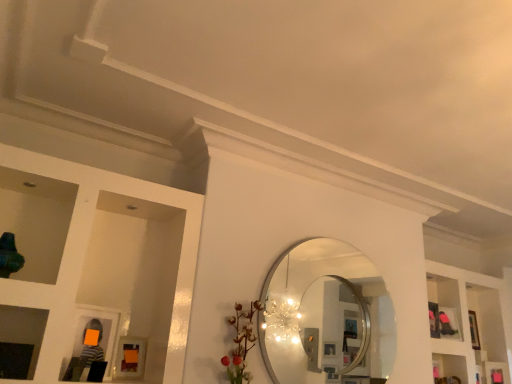
Measure the distance between point (464, 301) and camera.

3.80 meters.

Identify the location of silver metallic mirror at center. (325, 316).

I want to click on shelf behind the matte orange picture frame at lower left, so click(477, 321).

Does white glossy shelves at upper right have a lesser height compared to matte orange picture frame at lower left?

No, white glossy shelves at upper right is not shorter than matte orange picture frame at lower left.

In the scene shown: Considering the relative sizes of white glossy shelves at upper right and matte orange picture frame at lower left in the image provided, is white glossy shelves at upper right smaller than matte orange picture frame at lower left?

No, white glossy shelves at upper right is not smaller than matte orange picture frame at lower left.

Considering the positions of point (498, 292) and point (138, 368), is point (498, 292) closer or farther from the camera than point (138, 368)?

Point (498, 292).

Can you confirm if matte orange picture frame at lower left is shorter than silver metallic mirror at center?

Yes.

From the image's perspective, which is below, matte orange picture frame at lower left or silver metallic mirror at center?

matte orange picture frame at lower left, from the image's perspective.

Where is `mirror behind the matte orange picture frame at lower left`? The height and width of the screenshot is (384, 512). mirror behind the matte orange picture frame at lower left is located at coordinates (325, 316).

How far apart are matte orange picture frame at lower left and silver metallic mirror at center?

3.73 feet.

What's the angular difference between matte orange picture frame at lower left and white glossy shelves at upper right's facing directions?

The angle between the facing direction of matte orange picture frame at lower left and the facing direction of white glossy shelves at upper right is 2.49 degrees.

Does matte orange picture frame at lower left have a greater height compared to white glossy shelves at upper right?

No, matte orange picture frame at lower left is not taller than white glossy shelves at upper right.

Find the location of a particular element. shelf behind the matte orange picture frame at lower left is located at coordinates (477, 321).

Which object is wider, silver metallic mirror at center or white glossy shelves at upper right?

white glossy shelves at upper right.

Measure the distance between silver metallic mirror at center and white glossy shelves at upper right.

silver metallic mirror at center is 1.91 meters away from white glossy shelves at upper right.

Which of these two, silver metallic mirror at center or white glossy shelves at upper right, stands taller?

With more height is white glossy shelves at upper right.

What are the coordinates of `mirror that is under the white glossy shelves at upper right (from a real-world perspective)` in the screenshot? It's located at (325, 316).

From a real-world perspective, which object stands above the other?

silver metallic mirror at center, from a real-world perspective.

Is silver metallic mirror at center positioned in front of matte orange picture frame at lower left?

No, it is behind matte orange picture frame at lower left.

Looking at this image, from the image's perspective, who appears lower, silver metallic mirror at center or matte orange picture frame at lower left?

matte orange picture frame at lower left is shown below in the image.

Considering the relative sizes of white glossy shelves at upper right and silver metallic mirror at center in the image provided, is white glossy shelves at upper right bigger than silver metallic mirror at center?

Yes, white glossy shelves at upper right is bigger than silver metallic mirror at center.

Is the depth of white glossy shelves at upper right greater than that of silver metallic mirror at center?

Yes.

Is point (437, 273) positioned behind point (339, 310)?

Yes.

Does white glossy shelves at upper right appear on the right side of silver metallic mirror at center?

Indeed, white glossy shelves at upper right is positioned on the right side of silver metallic mirror at center.

This screenshot has width=512, height=384. I want to click on picture frame below the white glossy shelves at upper right (from a real-world perspective), so click(x=130, y=358).

I want to click on picture frame that is in front of the silver metallic mirror at center, so click(x=130, y=358).

Looking at the image, which one is located further to white glossy shelves at upper right, matte orange picture frame at lower left or silver metallic mirror at center?

matte orange picture frame at lower left is further to white glossy shelves at upper right.

Based on their spatial positions, is white glossy shelves at upper right or silver metallic mirror at center closer to matte orange picture frame at lower left?

silver metallic mirror at center is positioned closer to the anchor matte orange picture frame at lower left.

When comparing their distances from matte orange picture frame at lower left, does silver metallic mirror at center or white glossy shelves at upper right seem further?

The object further to matte orange picture frame at lower left is white glossy shelves at upper right.

From the image, which object appears to be farther from silver metallic mirror at center, matte orange picture frame at lower left or white glossy shelves at upper right?

white glossy shelves at upper right is further to silver metallic mirror at center.

From the image, which object appears to be farther from white glossy shelves at upper right, silver metallic mirror at center or matte orange picture frame at lower left?

The object further to white glossy shelves at upper right is matte orange picture frame at lower left.

Estimate the real-world distances between objects in this image. Which object is closer to silver metallic mirror at center, white glossy shelves at upper right or matte orange picture frame at lower left?

The object closer to silver metallic mirror at center is matte orange picture frame at lower left.

At what (x,y) coordinates should I click in order to perform the action: click on mirror between matte orange picture frame at lower left and white glossy shelves at upper right. Please return your answer as a coordinate pair (x, y). This screenshot has height=384, width=512. Looking at the image, I should click on (325, 316).